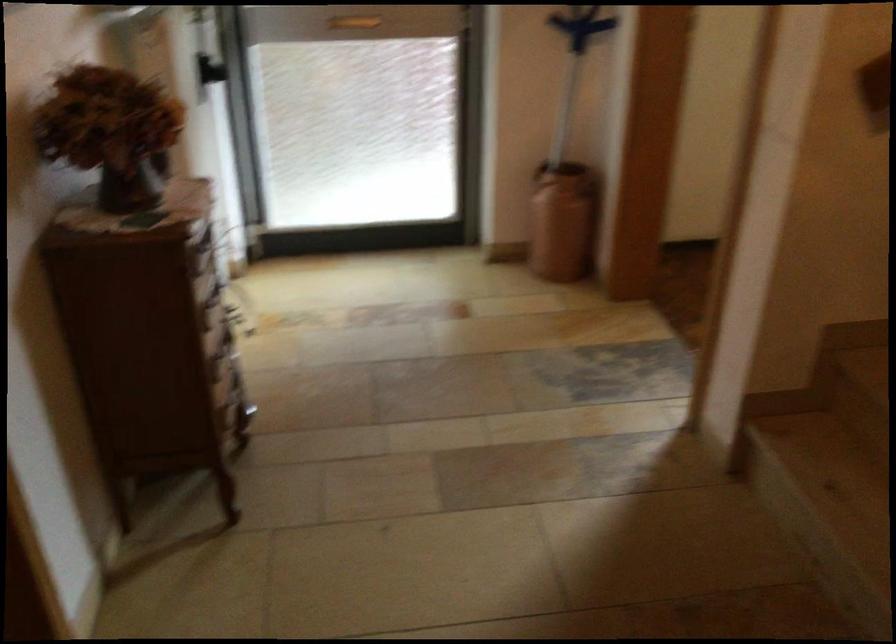
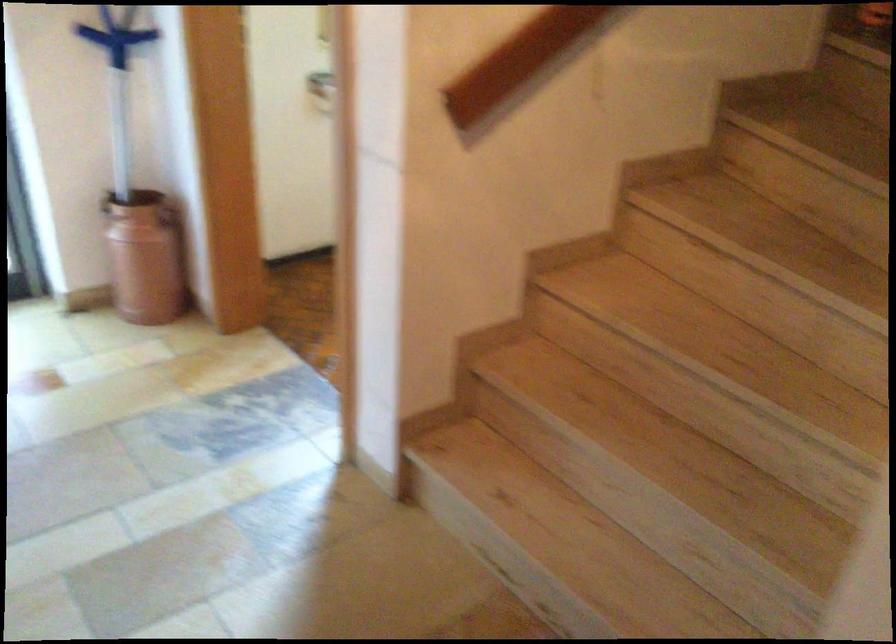
In the second image, find the point that corresponds to the point at 533,169 in the first image.

(105, 202)